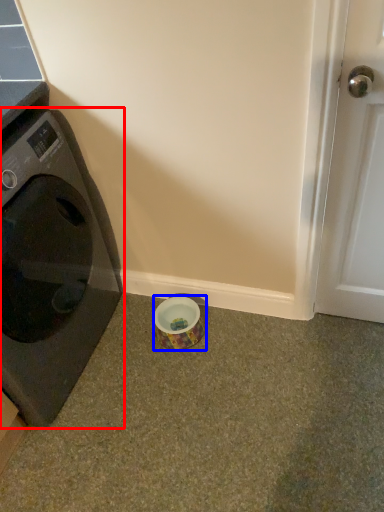
Question: Which of the following is the closest to the observer, washing machine (highlighted by a red box) or tape (highlighted by a blue box)?

Choices:
 (A) washing machine
 (B) tape

Answer: (A)